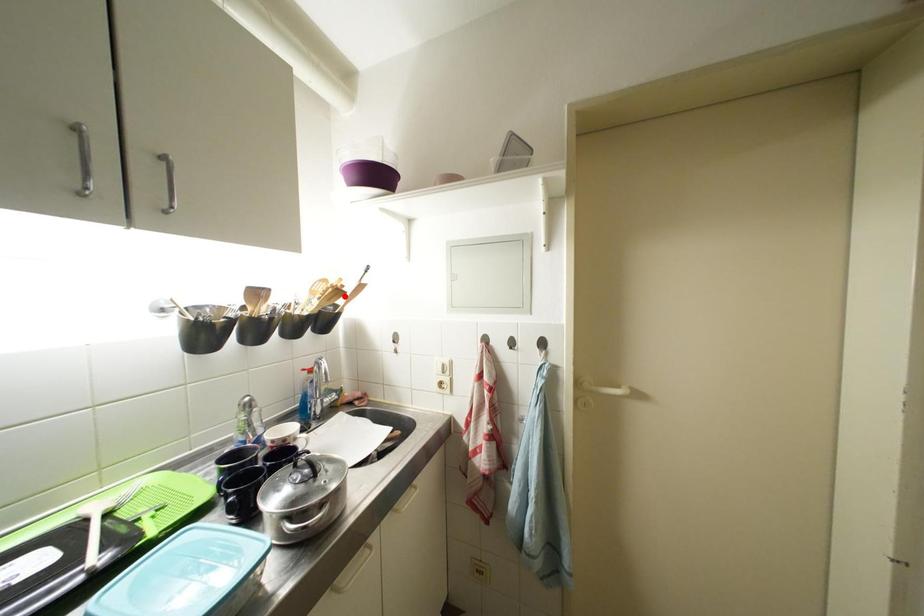
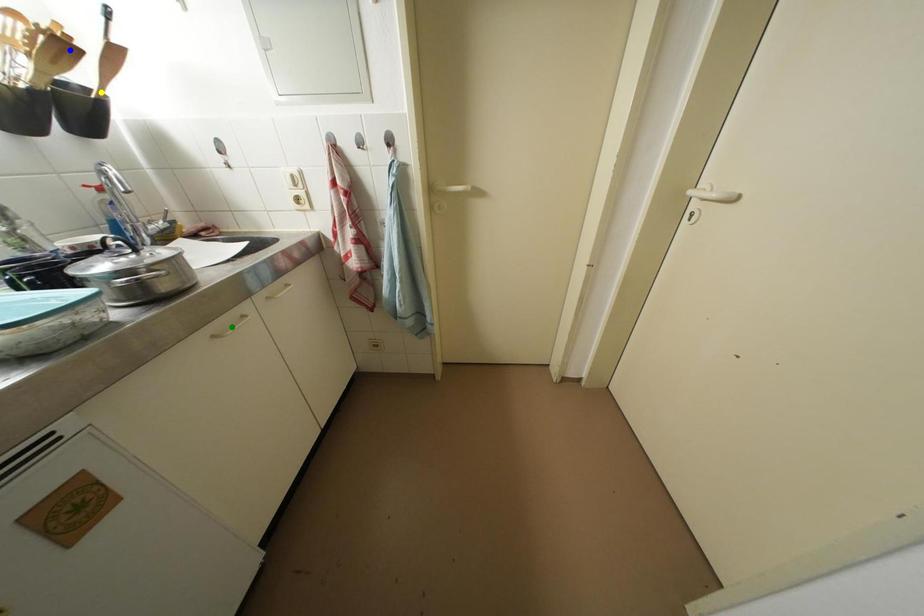
Question: I am providing you with two images of the same scene from different viewpoints. A red point is marked on the first image. You are given multiple points on the second image. Which mark in image 2 goes with the point in image 1?

Choices:
 (A) blue point
 (B) yellow point
 (C) green point

Answer: (A)